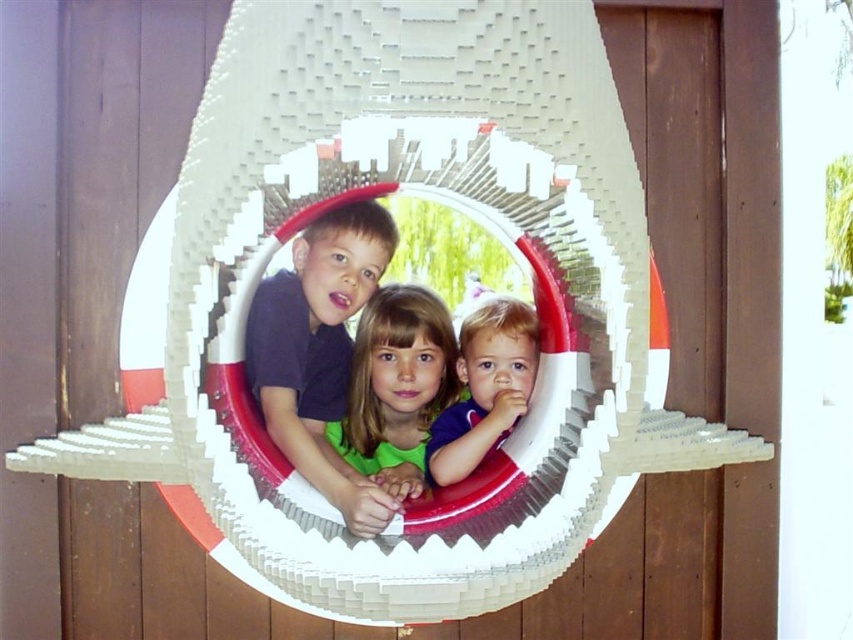
You are a photographer standing in front of the circular LEGO structure. You notice two children wearing the matte black shirt at center and smooth green shirt at center. Which child is positioned closer to you?

The matte black shirt at center is closer to the viewer than the smooth green shirt at center, so the child wearing the matte black shirt at center is positioned closer to you.

Consider the image. You are a photographer trying to capture a clear shot of the matte black shirt at center and the smooth purple shirt at center. Which one is closer to the camera?

The matte black shirt at center is in front of the smooth purple shirt at center, so it is closer to the camera.